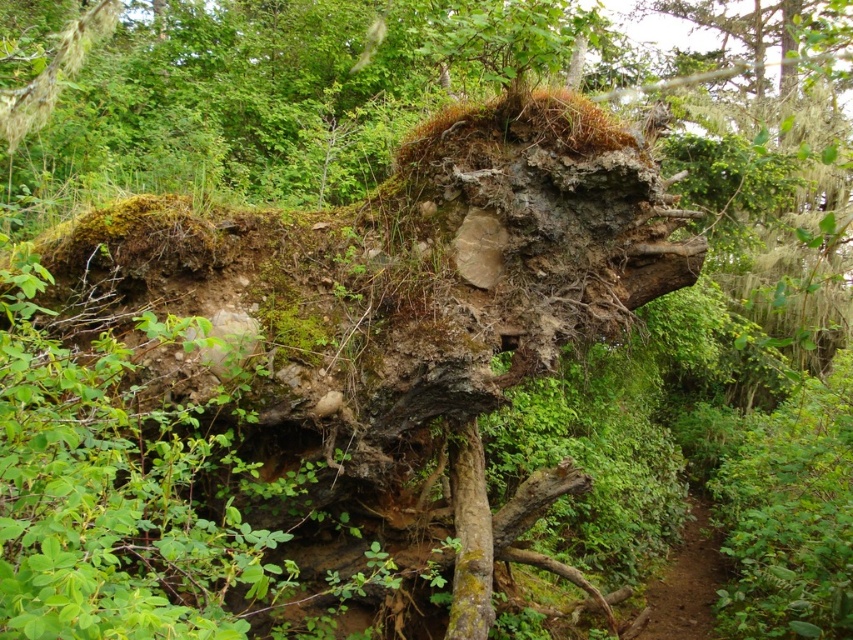
Is green mossy bark at center above brown dirt path at lower right?

Correct, green mossy bark at center is located above brown dirt path at lower right.

Is green mossy bark at center taller than brown dirt path at lower right?

Yes.

Who is more forward, [469,616] or [695,506]?

Positioned in front is point [469,616].

The image size is (853, 640). Identify the location of green mossy bark at center. (469, 538).